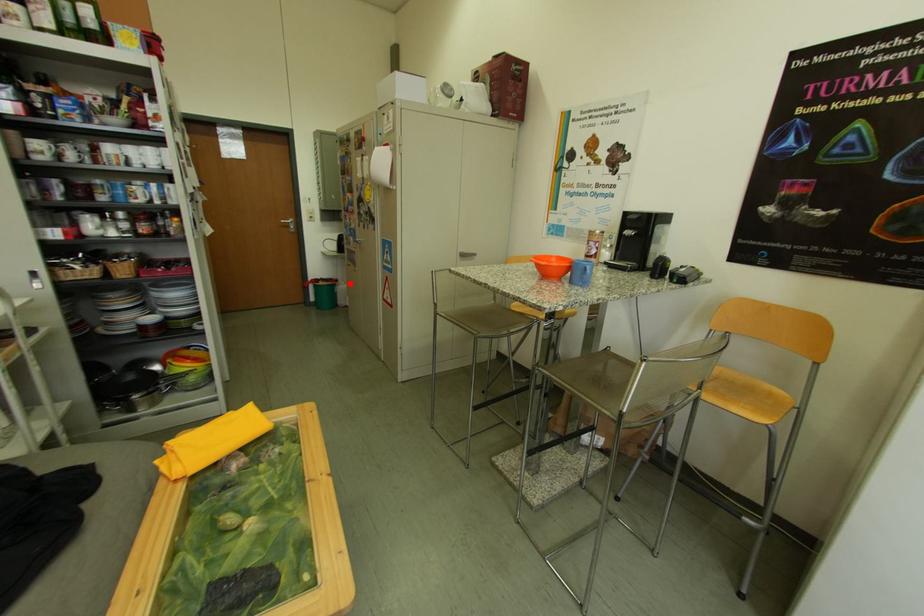
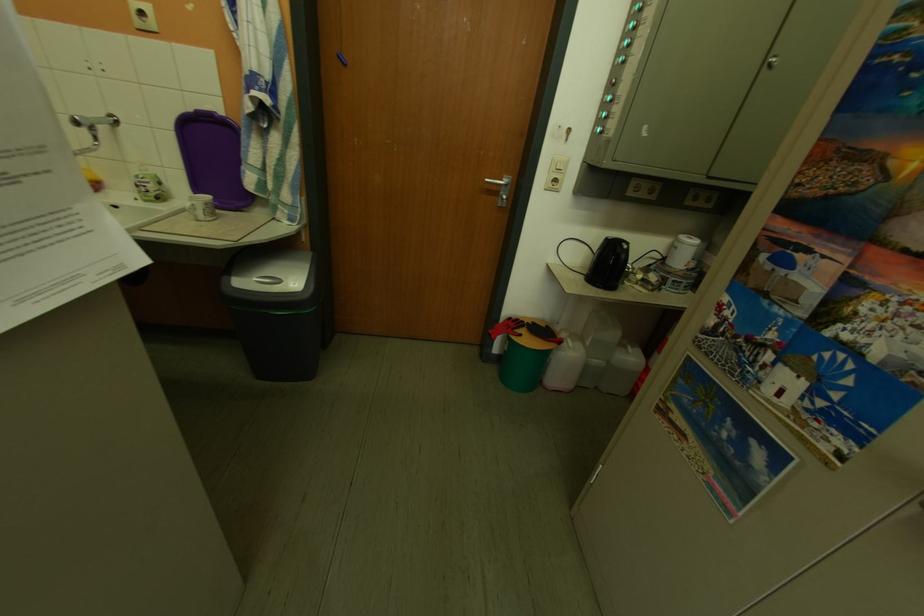
Find the pixel in the second image that matches the highlighted location in the first image.

(574, 345)